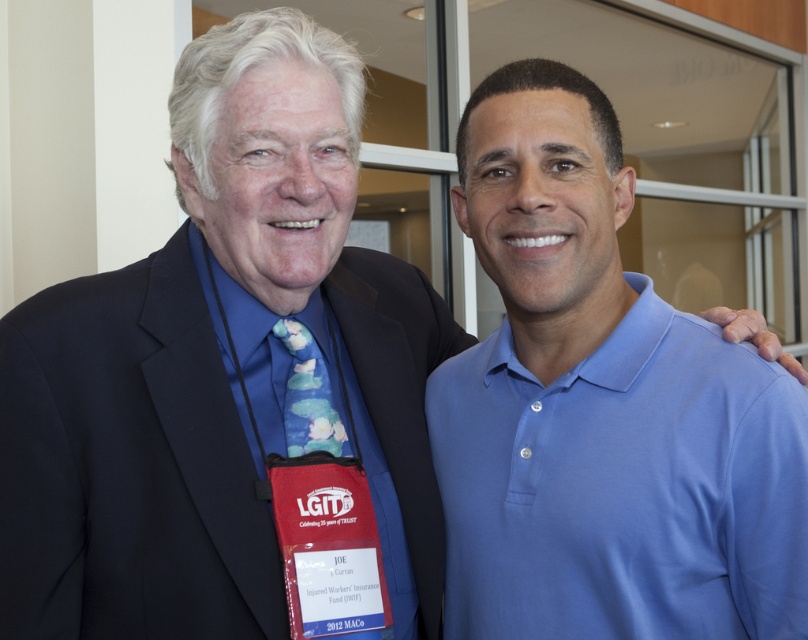
You are a photographer who needs to adjust the lighting to ensure both the blue smooth polo shirt at right and the blue floral tie at center are clearly visible. Which item should you focus on first to avoid shadows obscuring its details?

The blue floral tie at center should be focused on first because it is above the blue smooth polo shirt at right, so shadows from the shirt might fall onto it and obscure its details.

You are a photographer setting up for a group photo. You need to ensure there is enough space between the blue smooth polo shirt at right and the blue floral tie at center to avoid overlapping in the photo. What is the minimum distance you should maintain between them?

The blue smooth polo shirt at right and blue floral tie at center are 11.97 inches apart from each other. To avoid overlapping, the minimum distance should be at least 11.97 inches.